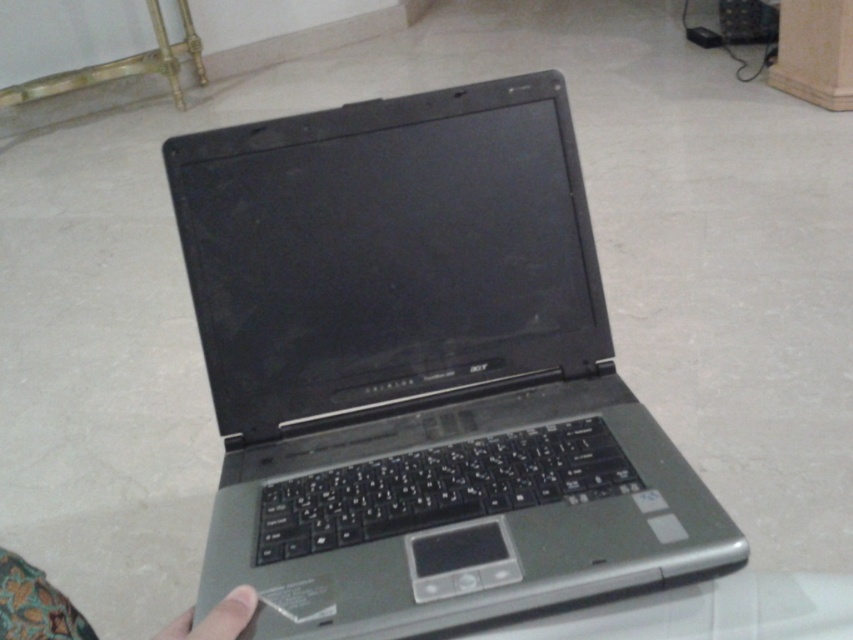
Who is taller, satin silver laptop at center or skin/soft/hand at lower center?

satin silver laptop at center is taller.

The width and height of the screenshot is (853, 640). What do you see at coordinates (421, 369) in the screenshot? I see `satin silver laptop at center` at bounding box center [421, 369].

The width and height of the screenshot is (853, 640). Describe the element at coordinates (421, 369) in the screenshot. I see `satin silver laptop at center` at that location.

Where is `satin silver laptop at center`? This screenshot has height=640, width=853. satin silver laptop at center is located at coordinates (421, 369).

What do you see at coordinates (35, 604) in the screenshot?
I see `skinny finger at lower left` at bounding box center [35, 604].

Which is in front, point (55, 588) or point (210, 616)?

Point (210, 616) is in front.

You are a GUI agent. You are given a task and a screenshot of the screen. Output one action in this format:
    pyautogui.click(x=<x>, y=<y>)
    Task: Click on the skinny finger at lower left
    This screenshot has width=853, height=640.
    Given the screenshot: What is the action you would take?
    pyautogui.click(x=35, y=604)

Identify the location of satin silver laptop at center. (421, 369).

Describe the element at coordinates (421, 369) in the screenshot. I see `satin silver laptop at center` at that location.

I want to click on satin silver laptop at center, so click(x=421, y=369).